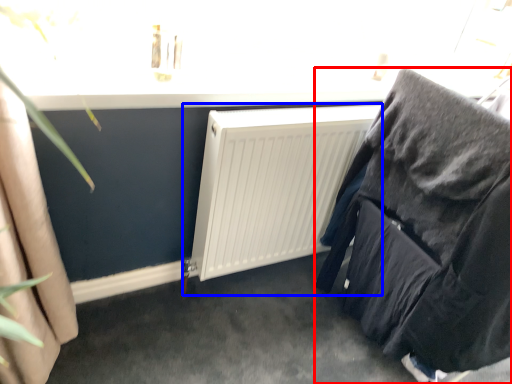
Question: Which of the following is the farthest to the observer, furniture (highlighted by a red box) or radiator (highlighted by a blue box)?

Choices:
 (A) furniture
 (B) radiator

Answer: (B)